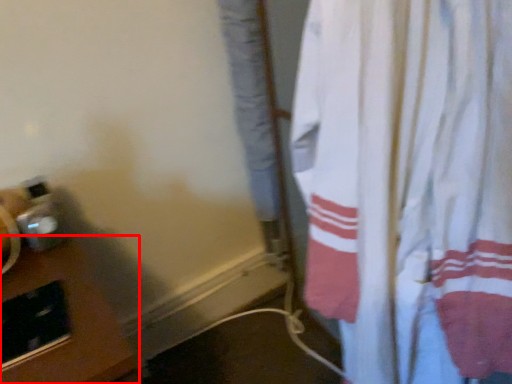
Question: From the image's perspective, where is table (annotated by the red box) located in relation to curtain in the image?

Choices:
 (A) below
 (B) above

Answer: (A)